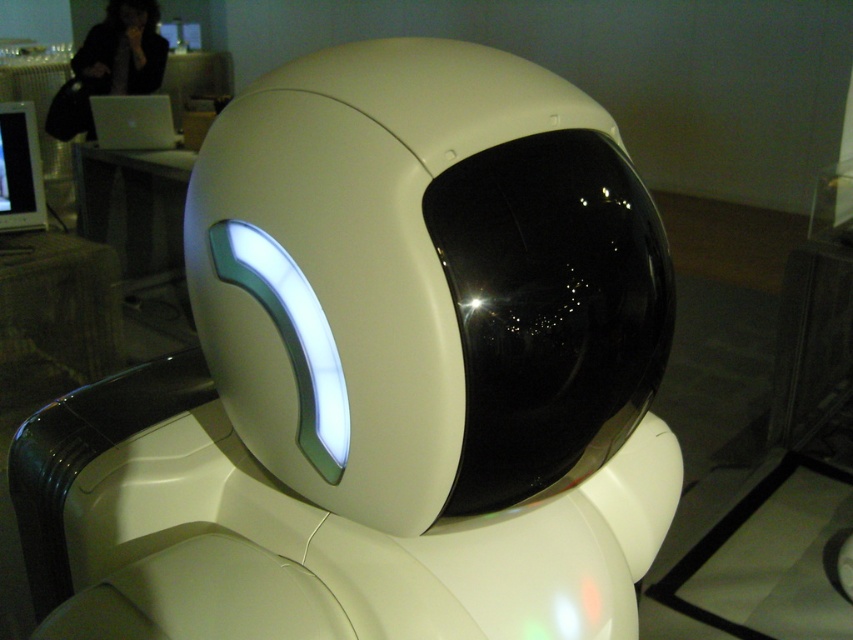
You are an engineer inspecting a tech exhibition. You notice the white glossy robot head at center and the matte black monitor at left. Which object is located higher in the image?

The white glossy robot head at center is positioned under the matte black monitor at left, so the matte black monitor at left is higher in the image.

You are standing in front of the futuristic robot and notice two points on its surface. The first point is at coordinate point (517, 204) and the second is at point (138, 132). Which of these points is nearer to your position?

Point (517, 204) is closer to the viewer than point (138, 132), so the first point is nearer to your position.